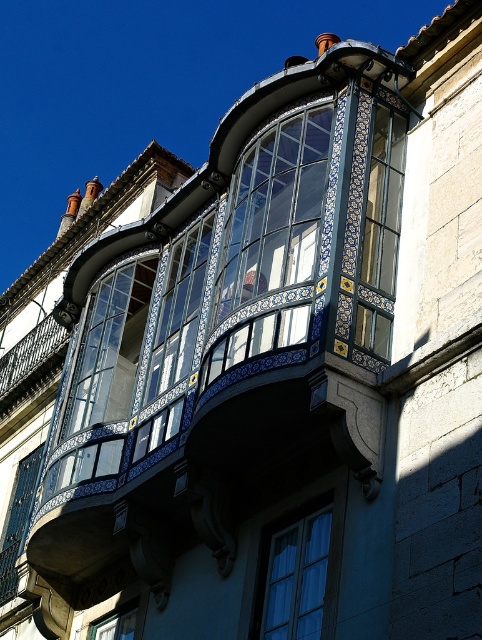
Question: Is translucent glass bay window at center to the right of matte glass window at center from the viewer's perspective?

Choices:
 (A) yes
 (B) no

Answer: (B)

Question: Is translucent glass bay window at center to the right of clear glass window at lower center from the viewer's perspective?

Choices:
 (A) no
 (B) yes

Answer: (B)

Question: Which object appears closest to the camera in this image?

Choices:
 (A) white glass window at lower center
 (B) blue glass window at center
 (C) blue glass balcony at center

Answer: (A)

Question: Which object appears closest to the camera in this image?

Choices:
 (A) matte glass window at center
 (B) translucent glass bay window at center

Answer: (A)

Question: Is translucent glass bay window at center to the right of white glass window at lower center from the viewer's perspective?

Choices:
 (A) no
 (B) yes

Answer: (A)

Question: Based on their relative distances, which object is farther from the clear glass window at lower center?

Choices:
 (A) blue glass balcony at center
 (B) blue glass window at center
 (C) matte glass window at center
 (D) translucent glass bay window at center

Answer: (C)